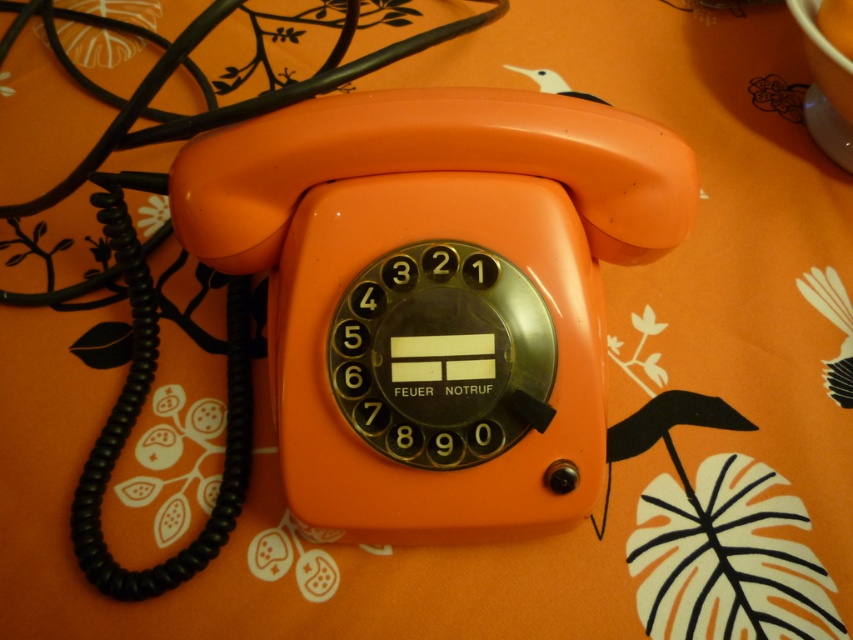
Question: Which point appears farthest from the camera in this image?

Choices:
 (A) (837, 20)
 (B) (389, 252)

Answer: (A)

Question: Can you confirm if orange matte phone at center is positioned above matte plastic cup at upper center?

Choices:
 (A) no
 (B) yes

Answer: (A)

Question: Is orange matte phone at center to the left of matte plastic cup at upper center from the viewer's perspective?

Choices:
 (A) no
 (B) yes

Answer: (B)

Question: Does orange matte phone at center appear on the right side of matte plastic cup at upper center?

Choices:
 (A) yes
 (B) no

Answer: (B)